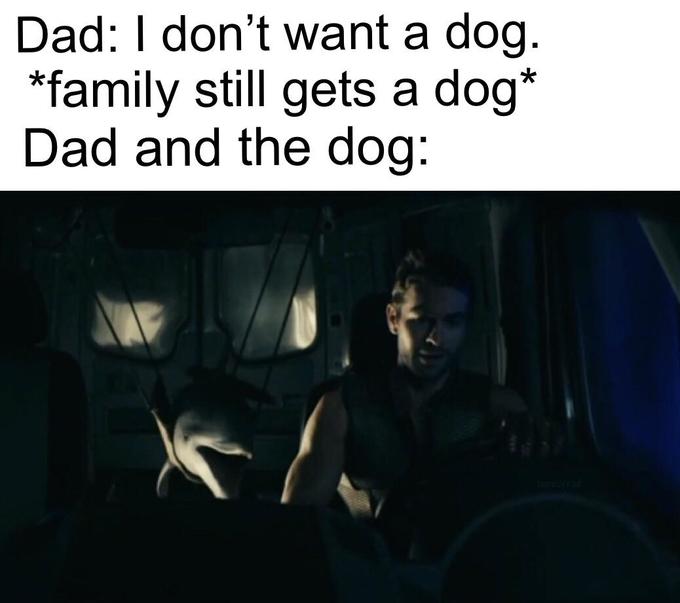
You are a GUI agent. You are given a task and a screenshot of the screen. Output one action in this format:
    pyautogui.click(x=<x>, y=<y>)
    Task: Click on the door
    
    Given the screenshot: What is the action you would take?
    pyautogui.click(x=269, y=371), pyautogui.click(x=126, y=377), pyautogui.click(x=647, y=497)